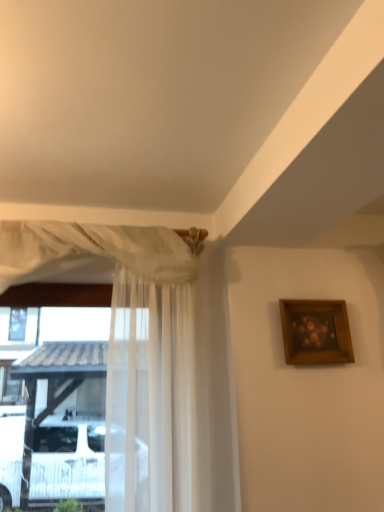
Describe the element at coordinates (316, 332) in the screenshot. Image resolution: width=384 pixels, height=512 pixels. I see `wooden frame at upper right` at that location.

Find the location of `wooden frame at upper right`. wooden frame at upper right is located at coordinates (316, 332).

This screenshot has height=512, width=384. I want to click on wooden frame at upper right, so point(316,332).